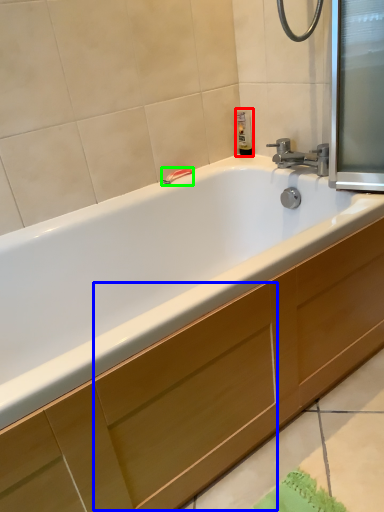
Question: Which is farther away from soap dispenser (highlighted by a red box)? drawer (highlighted by a blue box) or towel bar (highlighted by a green box)?

Choices:
 (A) drawer
 (B) towel bar

Answer: (A)